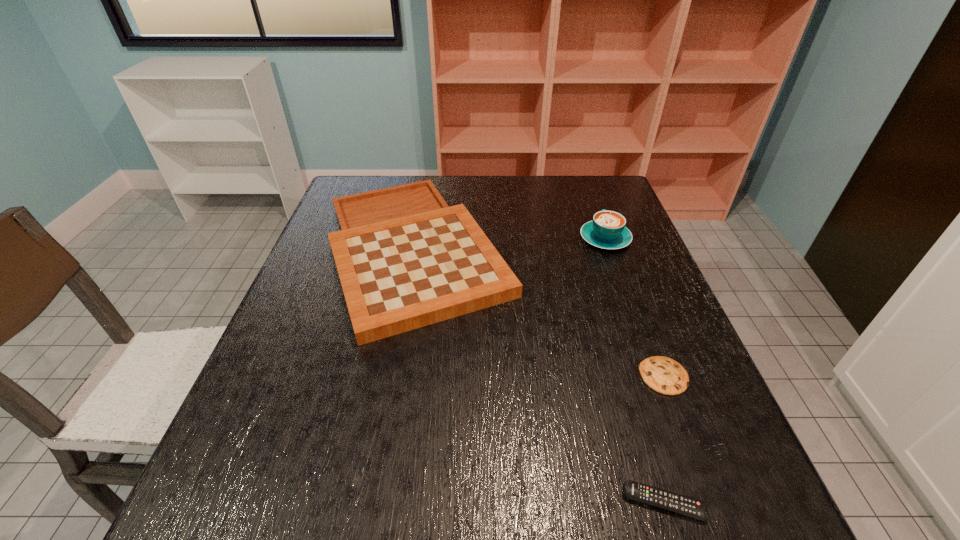
The height and width of the screenshot is (540, 960). What are the coordinates of `cappuccino` in the screenshot? It's located at (607, 230).

Locate an element on the screen. The width and height of the screenshot is (960, 540). the second tallest object is located at coordinates (405, 259).

I want to click on gameboard, so click(x=405, y=259).

You are a GUI agent. You are given a task and a screenshot of the screen. Output one action in this format:
    pyautogui.click(x=<x>, y=<y>)
    Task: Click on the third farthest object
    This screenshot has height=540, width=960.
    Given the screenshot: What is the action you would take?
    pos(664,375)

Image resolution: width=960 pixels, height=540 pixels. Find the location of `the nearest object`. the nearest object is located at coordinates (677, 503).

I want to click on free space located with the handle on the right side of the cappuccino, so click(591, 201).

The width and height of the screenshot is (960, 540). I want to click on vacant region located with the handle on the right side of the cappuccino, so click(x=591, y=200).

In order to click on vacant area situated 0.170m with the handle on the right side of the cappuccino in this screenshot , I will do `click(589, 195)`.

Find the location of a particular element. Image resolution: width=960 pixels, height=540 pixels. vacant space located on the front of the gameboard is located at coordinates (375, 469).

Identify the location of vacant space located on the front of the second nearest object. Image resolution: width=960 pixels, height=540 pixels. (694, 455).